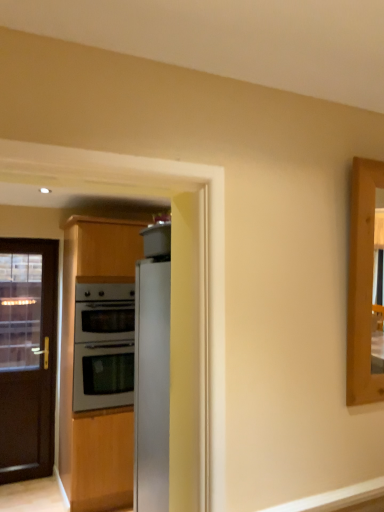
You are a GUI agent. You are given a task and a screenshot of the screen. Output one action in this format:
    pyautogui.click(x=<x>, y=<y>)
    Task: Click on the sleek metallic refrigerator at center
    The width and height of the screenshot is (384, 512).
    Given the screenshot: What is the action you would take?
    [152, 385]

This screenshot has height=512, width=384. What do you see at coordinates (152, 385) in the screenshot? I see `sleek metallic refrigerator at center` at bounding box center [152, 385].

The width and height of the screenshot is (384, 512). What are the coordinates of `black glass door at left` in the screenshot? It's located at (27, 357).

Which object is thinner, sleek metallic refrigerator at center or black glass door at left?

black glass door at left is thinner.

Could black glass door at left be considered to be inside sleek metallic refrigerator at center?

No.

Is sleek metallic refrigerator at center in front of or behind black glass door at left in the image?

sleek metallic refrigerator at center is in front of black glass door at left.

Could satin silver oven at center be considered to be inside black glass door at left?

That's incorrect, satin silver oven at center is not inside black glass door at left.

Between black glass door at left and satin silver oven at center, which one has larger width?

satin silver oven at center is wider.

Which object is more forward, black glass door at left or sleek metallic refrigerator at center?

Positioned in front is sleek metallic refrigerator at center.

Which is more distant, (31,271) or (151,336)?

The point (31,271) is behind.

Between black glass door at left and sleek metallic refrigerator at center, which one appears on the right side from the viewer's perspective?

sleek metallic refrigerator at center is more to the right.

Based on the photo, does black glass door at left turn towards sleek metallic refrigerator at center?

Yes, black glass door at left is turned towards sleek metallic refrigerator at center.

Is point (125, 283) closer to viewer compared to point (135, 478)?

That is False.

Considering the relative sizes of satin silver oven at center and sleek metallic refrigerator at center in the image provided, is satin silver oven at center smaller than sleek metallic refrigerator at center?

No, satin silver oven at center is not smaller than sleek metallic refrigerator at center.

From a real-world perspective, is satin silver oven at center over sleek metallic refrigerator at center?

Correct, in the physical world, satin silver oven at center is higher than sleek metallic refrigerator at center.

Is satin silver oven at center shorter than black glass door at left?

Correct, satin silver oven at center is not as tall as black glass door at left.

Can you see satin silver oven at center touching black glass door at left?

No, satin silver oven at center is not making contact with black glass door at left.

Does point (114, 327) come closer to viewer compared to point (43, 457)?

Yes, point (114, 327) is in front of point (43, 457).

Between satin silver oven at center and black glass door at left, which one has smaller width?

black glass door at left.

Would you say sleek metallic refrigerator at center is inside or outside satin silver oven at center?

sleek metallic refrigerator at center is not enclosed by satin silver oven at center.

Where is `oven that appears below the sleek metallic refrigerator at center (from the image's perspective)`? oven that appears below the sleek metallic refrigerator at center (from the image's perspective) is located at coordinates (103, 346).

Does sleek metallic refrigerator at center have a greater height compared to satin silver oven at center?

Yes, sleek metallic refrigerator at center is taller than satin silver oven at center.

In the scene shown: From the image's perspective, is sleek metallic refrigerator at center above satin silver oven at center?

Indeed, from the image's perspective, sleek metallic refrigerator at center is shown above satin silver oven at center.

Identify the location of refrigerator on the right of the black glass door at left. (152, 385).

In order to click on oven in front of the black glass door at left in this screenshot , I will do `click(103, 346)`.

Looking at the image, which one is located further to satin silver oven at center, sleek metallic refrigerator at center or black glass door at left?

Based on the image, sleek metallic refrigerator at center appears to be further to satin silver oven at center.

Based on their spatial positions, is black glass door at left or sleek metallic refrigerator at center further from satin silver oven at center?

sleek metallic refrigerator at center.

Consider the image. Looking at the image, which one is located closer to black glass door at left, sleek metallic refrigerator at center or satin silver oven at center?

satin silver oven at center is positioned closer to the anchor black glass door at left.

Considering their positions, is satin silver oven at center positioned closer to black glass door at left than sleek metallic refrigerator at center?

satin silver oven at center is positioned closer to the anchor black glass door at left.

From the image, which object appears to be farther from sleek metallic refrigerator at center, black glass door at left or satin silver oven at center?

Based on the image, black glass door at left appears to be further to sleek metallic refrigerator at center.

Which object lies nearer to the anchor point sleek metallic refrigerator at center, satin silver oven at center or black glass door at left?

Based on the image, satin silver oven at center appears to be nearer to sleek metallic refrigerator at center.

This screenshot has width=384, height=512. I want to click on oven located between sleek metallic refrigerator at center and black glass door at left in the depth direction, so click(x=103, y=346).